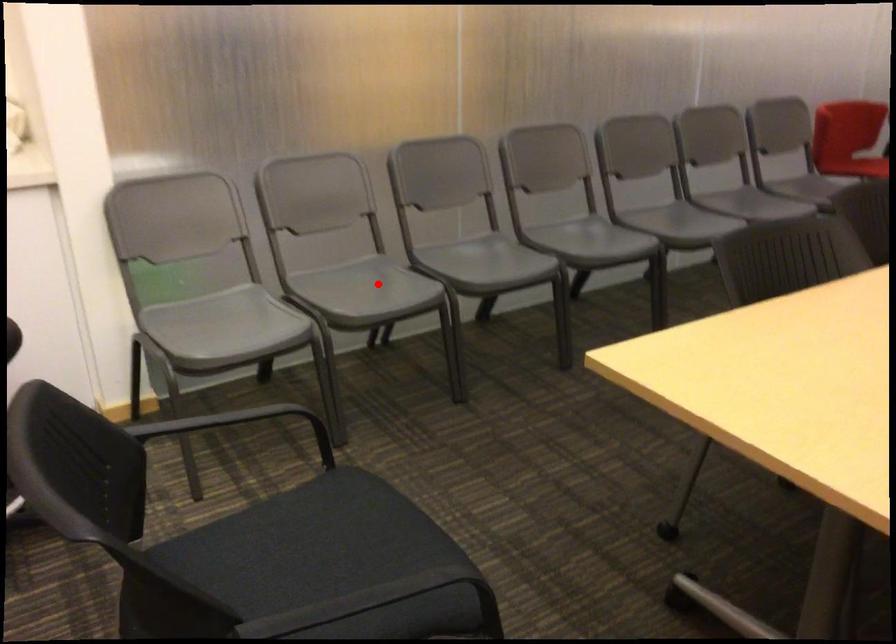
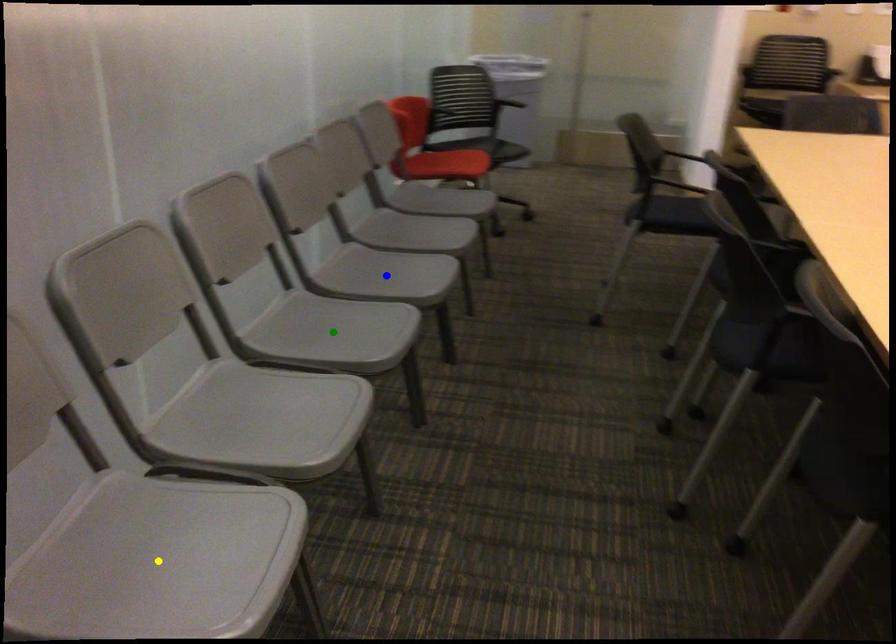
Question: I am providing you with two images of the same scene from different viewpoints. A red point is marked on the first image. You are given multiple points on the second image. Can you choose the point in image 2 that corresponds to the point in image 1?

Choices:
 (A) yellow point
 (B) green point
 (C) blue point

Answer: (A)